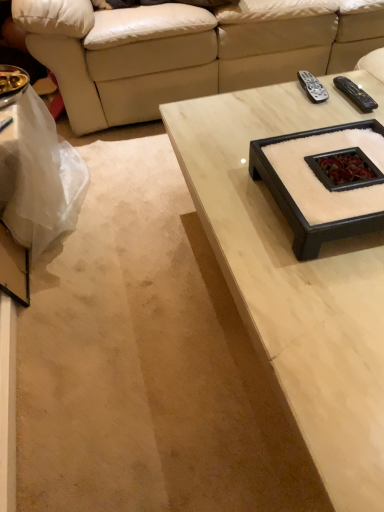
Locate an element on the screen. vacant space that is to the left of black plastic remote at upper right, acting as the 2th remote starting from the left is located at coordinates (304, 106).